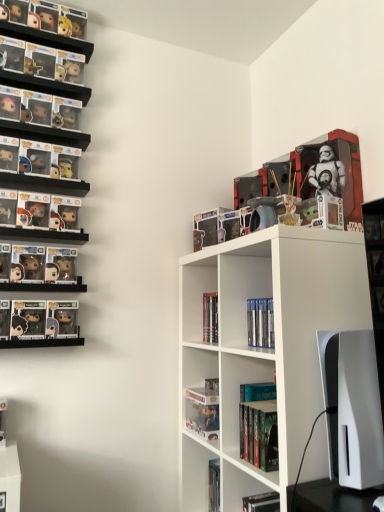
Question: Which direction should I rotate to look at hardcover book at lower center, which is the 1th book in bottom-to-top order, — up or down?

Choices:
 (A) up
 (B) down

Answer: (B)

Question: From the image's perspective, does hardcover book at center, placed as the 3th book when sorted from bottom to top, appear lower than white matte shelf at center?

Choices:
 (A) no
 (B) yes

Answer: (B)

Question: Is the depth of hardcover book at center, which ranks as the 3th book in top-to-bottom order, greater than that of white matte shelf at center?

Choices:
 (A) no
 (B) yes

Answer: (B)

Question: Does hardcover book at center, which ranks as the 3th book in top-to-bottom order, have a greater width compared to white matte shelf at center?

Choices:
 (A) no
 (B) yes

Answer: (A)

Question: Is hardcover book at center, which ranks as the 3th book in top-to-bottom order, next to white matte shelf at center?

Choices:
 (A) no
 (B) yes

Answer: (A)

Question: From a real-world perspective, is hardcover book at center, placed as the 3th book when sorted from bottom to top, positioned under white matte shelf at center based on gravity?

Choices:
 (A) no
 (B) yes

Answer: (B)

Question: Is hardcover book at center, which ranks as the 3th book in top-to-bottom order, facing away from white matte shelf at center?

Choices:
 (A) yes
 (B) no

Answer: (A)

Question: Is hardcover book at center, placed as the 3th book when sorted from bottom to top, not close to hardcover book at lower center, which is the 1th book in bottom-to-top order?

Choices:
 (A) yes
 (B) no

Answer: (B)

Question: Can we say hardcover book at center, placed as the 3th book when sorted from bottom to top, lies outside hardcover book at lower center, which is the 1th book in bottom-to-top order?

Choices:
 (A) yes
 (B) no

Answer: (A)

Question: Is hardcover book at center, which ranks as the 3th book in top-to-bottom order, closer to camera compared to hardcover book at lower center, which is the 1th book in bottom-to-top order?

Choices:
 (A) yes
 (B) no

Answer: (B)

Question: Could you tell me if hardcover book at center, placed as the 3th book when sorted from bottom to top, is facing hardcover book at lower center, which is the 1th book in bottom-to-top order?

Choices:
 (A) no
 (B) yes

Answer: (A)

Question: Could hardcover book at lower center, which is the 1th book in bottom-to-top order, be considered to be inside hardcover book at center, placed as the 3th book when sorted from bottom to top?

Choices:
 (A) no
 (B) yes

Answer: (A)

Question: Does hardcover book at center, which ranks as the 3th book in top-to-bottom order, have a smaller size compared to hardcover book at lower center, placed as the 5th book when sorted from top to bottom?

Choices:
 (A) yes
 (B) no

Answer: (A)

Question: Is clear plastic book at upper center, which is the fifth book in bottom-to-top order, inside clear plastic figure at lower center, arranged as the second book when ordered from the bottom?

Choices:
 (A) yes
 (B) no

Answer: (B)